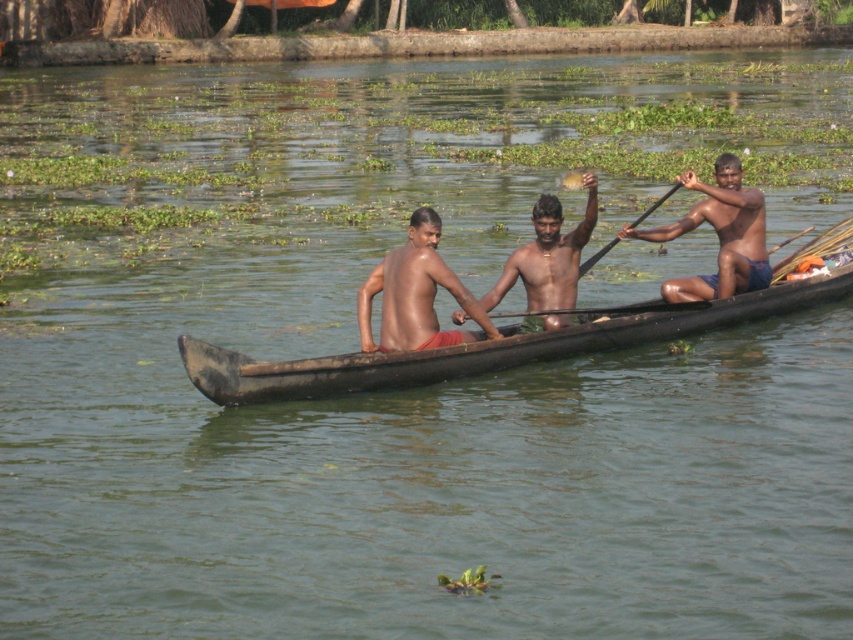
You are standing on the dock and see the dark brown wooden boat at center and the wooden paddle at center in the water. Which object is nearer to you?

The dark brown wooden boat at center is closer to the viewer than the wooden paddle at center, so the dark brown wooden boat at center is nearer to you.

Consider the image. You are standing on the shore of the water body shown in the image. You notice a point marked at coordinates (718,236). What object is located at that point?

The point at coordinates (718,236) marks the location of the shiny blue shorts at right.

In the scene shown: You are standing on the shore of the water body and see the dark brown wooden boat at center. Can you determine if the boat is in the middle of the water body based on its position at point (492, 346)?

The dark brown wooden boat at center is located at point (492, 346), which is the center of the image. Since the image shows the boat at the center, it is likely positioned in the middle of the water body.